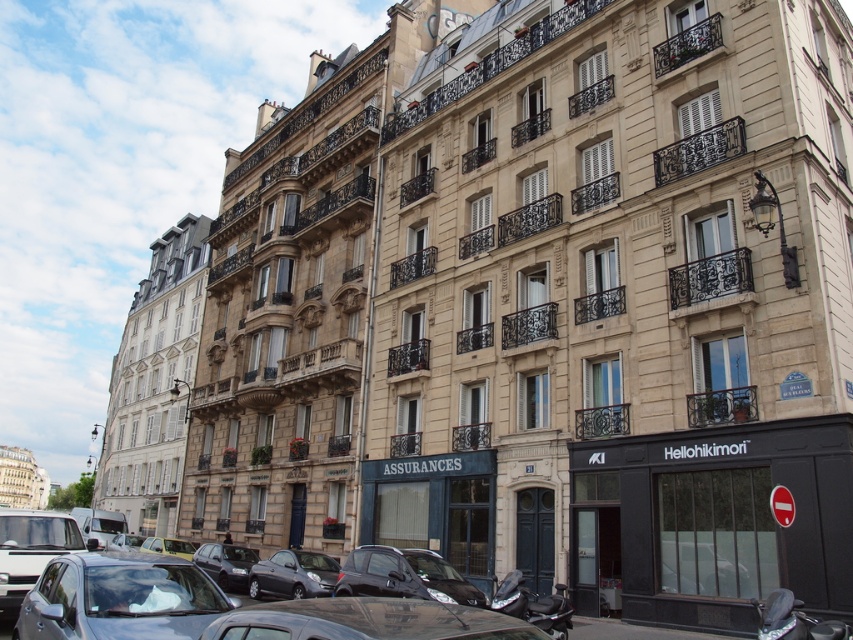
Question: Which object appears closest to the camera in this image?

Choices:
 (A) shiny black car at center
 (B) beige stone building at left
 (C) metallic gray hatchback at center

Answer: (A)

Question: Which is farther from the shiny black sedan at center?

Choices:
 (A) beige stone building at left
 (B) metallic gray hatchback at center
 (C) metallic gray car at lower left
 (D) shiny black car at center

Answer: (A)

Question: Is metallic gray car at lower left wider than shiny black sedan at center?

Choices:
 (A) yes
 (B) no

Answer: (A)

Question: From the image, what is the correct spatial relationship of shiny black car at center in relation to metallic gray car at lower left?

Choices:
 (A) below
 (B) above

Answer: (B)

Question: Does beige stone building at left have a larger size compared to metallic gray car at lower left?

Choices:
 (A) no
 (B) yes

Answer: (B)

Question: Which of the following is the closest to the observer?

Choices:
 (A) pyautogui.click(x=299, y=595)
 (B) pyautogui.click(x=57, y=611)

Answer: (B)